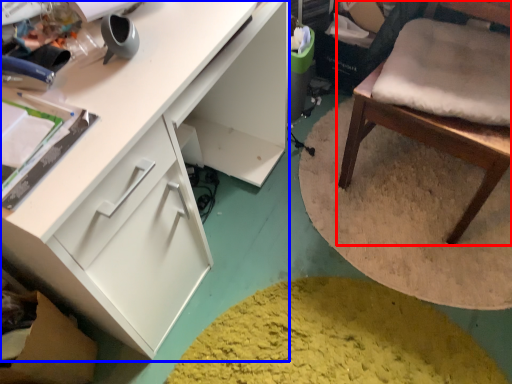
Question: Which of the following is the closest to the observer, chair (highlighted by a red box) or cabinetry (highlighted by a blue box)?

Choices:
 (A) chair
 (B) cabinetry

Answer: (B)